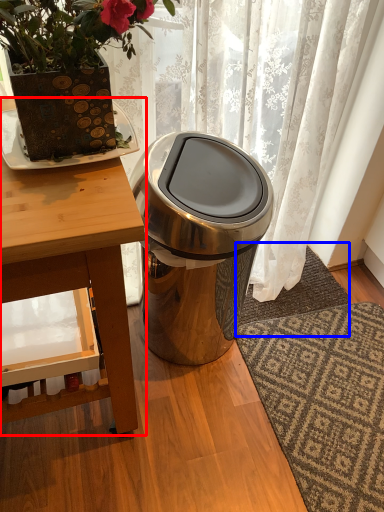
Question: Which object is closer to the camera taking this photo, table (highlighted by a red box) or doormat (highlighted by a blue box)?

Choices:
 (A) table
 (B) doormat

Answer: (A)